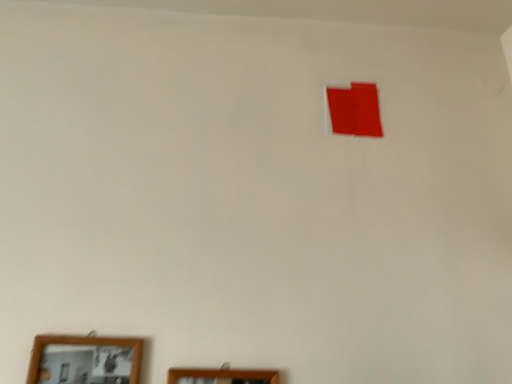
Question: From a real-world perspective, is wooden framed mirror at lower left, acting as the 2th picture frame starting from the right, physically located above or below wooden picture frame at lower center, positioned as the second picture frame in left-to-right order?

Choices:
 (A) above
 (B) below

Answer: (A)

Question: Visually, is wooden framed mirror at lower left, which is the first picture frame from left to right, positioned to the left or to the right of wooden picture frame at lower center, positioned as the second picture frame in left-to-right order?

Choices:
 (A) left
 (B) right

Answer: (A)

Question: Would you say wooden framed mirror at lower left, which is the first picture frame from left to right, is inside or outside wooden picture frame at lower center, which is the 1th picture frame from right to left?

Choices:
 (A) outside
 (B) inside

Answer: (A)

Question: Based on their positions, is wooden picture frame at lower center, which is the 1th picture frame from right to left, located to the left or right of wooden framed mirror at lower left, which is the first picture frame from left to right?

Choices:
 (A) right
 (B) left

Answer: (A)

Question: Which is correct: wooden picture frame at lower center, positioned as the second picture frame in left-to-right order, is inside wooden framed mirror at lower left, acting as the 2th picture frame starting from the right, or outside of it?

Choices:
 (A) inside
 (B) outside

Answer: (B)

Question: Considering the positions of wooden picture frame at lower center, which is the 1th picture frame from right to left, and wooden framed mirror at lower left, acting as the 2th picture frame starting from the right, in the image, is wooden picture frame at lower center, which is the 1th picture frame from right to left, wider or thinner than wooden framed mirror at lower left, acting as the 2th picture frame starting from the right,?

Choices:
 (A) thin
 (B) wide

Answer: (A)

Question: Based on their sizes in the image, would you say wooden picture frame at lower center, positioned as the second picture frame in left-to-right order, is bigger or smaller than wooden framed mirror at lower left, acting as the 2th picture frame starting from the right?

Choices:
 (A) small
 (B) big

Answer: (A)